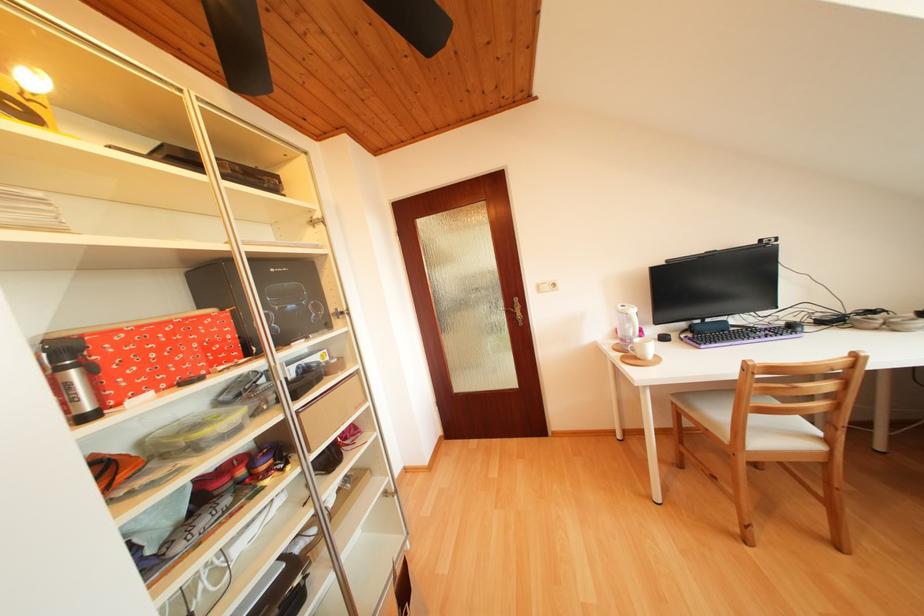
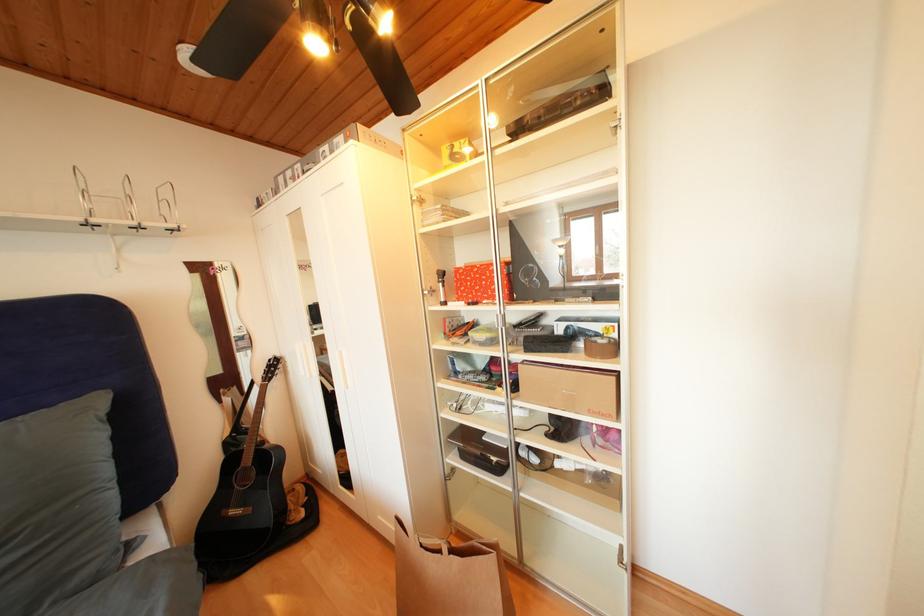
The first image is from the beginning of the video and the second image is from the end. How did the camera likely rotate when shooting the video?

The camera rotated toward left-down.